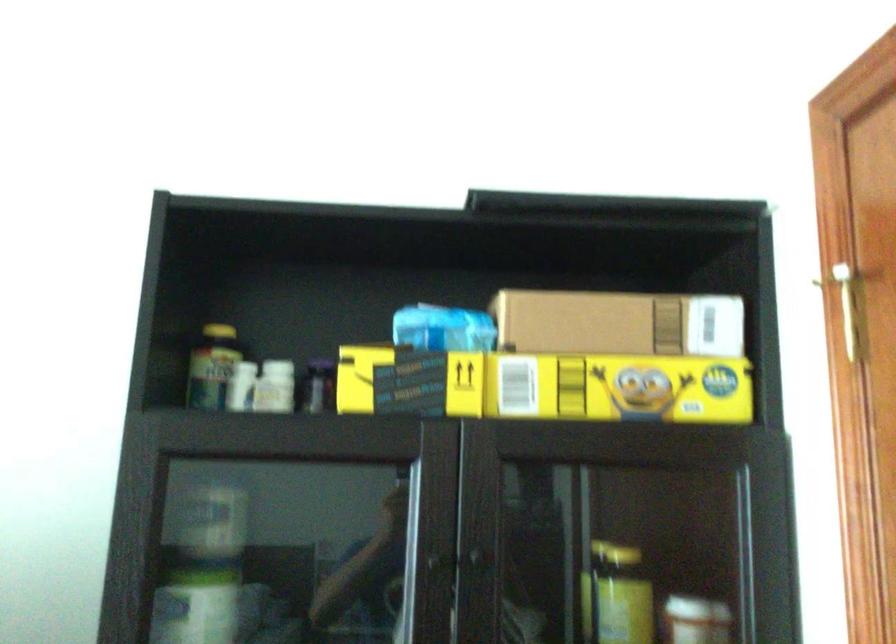
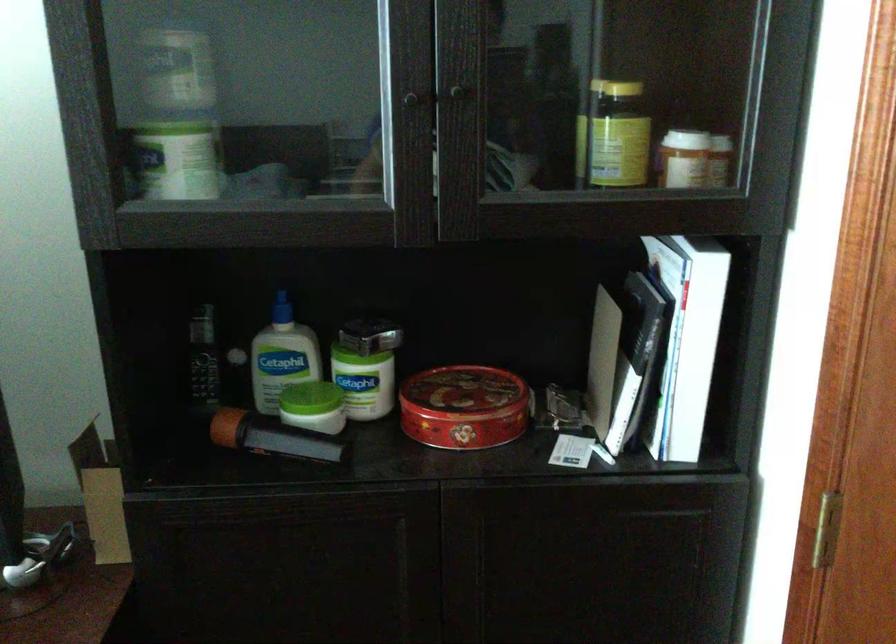
Find the pixel in the second image that matches [433,558] in the first image.

(409, 93)